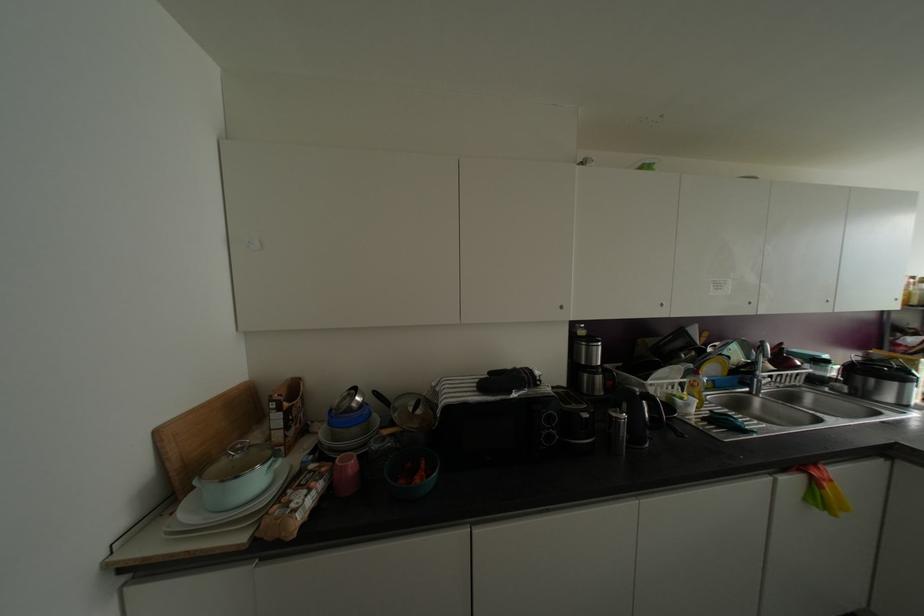
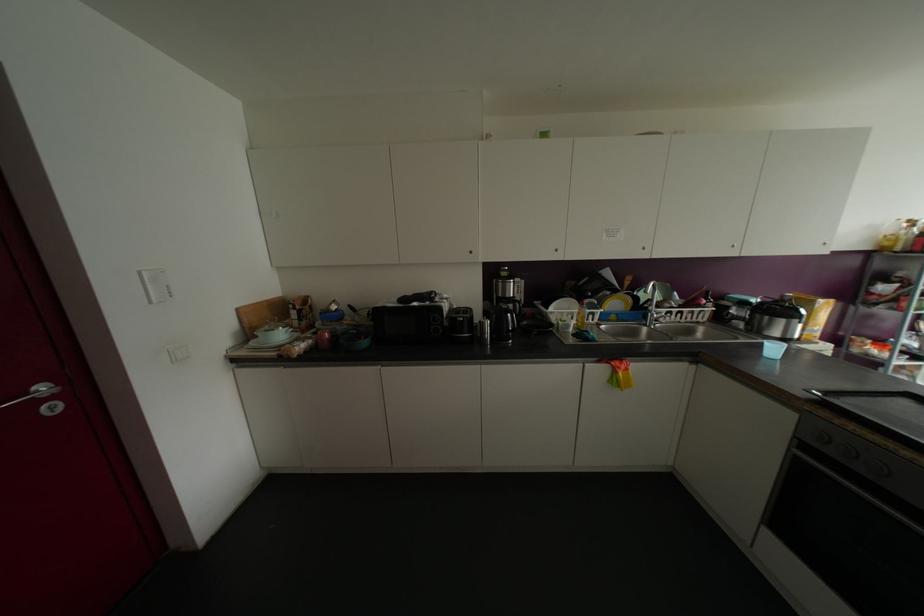
Where in the second image is the point corresponding to (x=561, y=307) from the first image?

(469, 252)